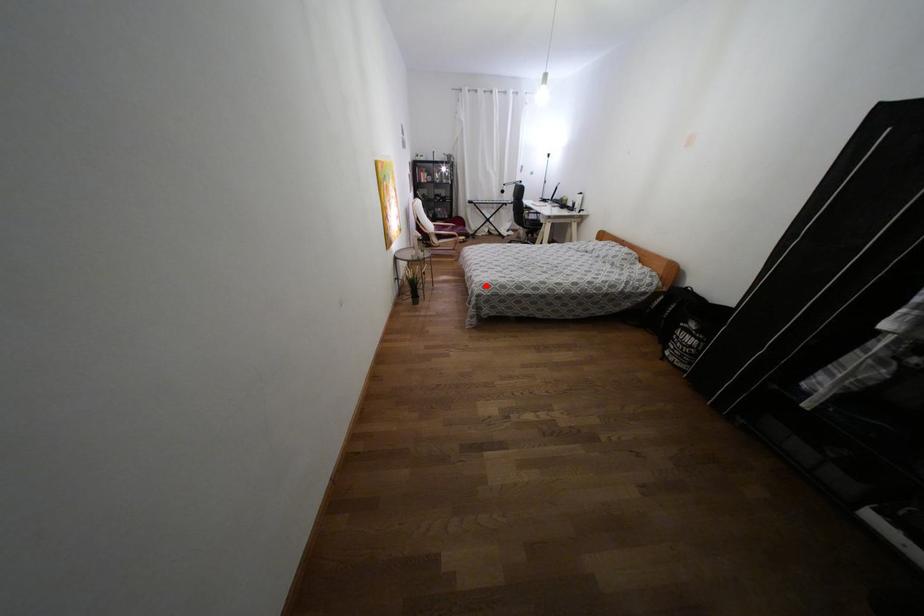
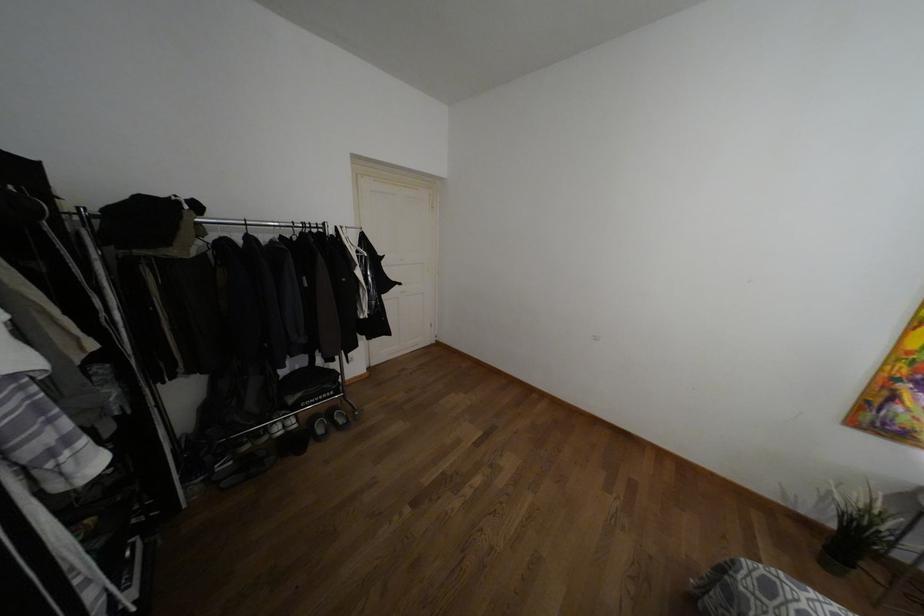
Find the pixel in the second image that matches the highlighted location in the first image.

(769, 588)